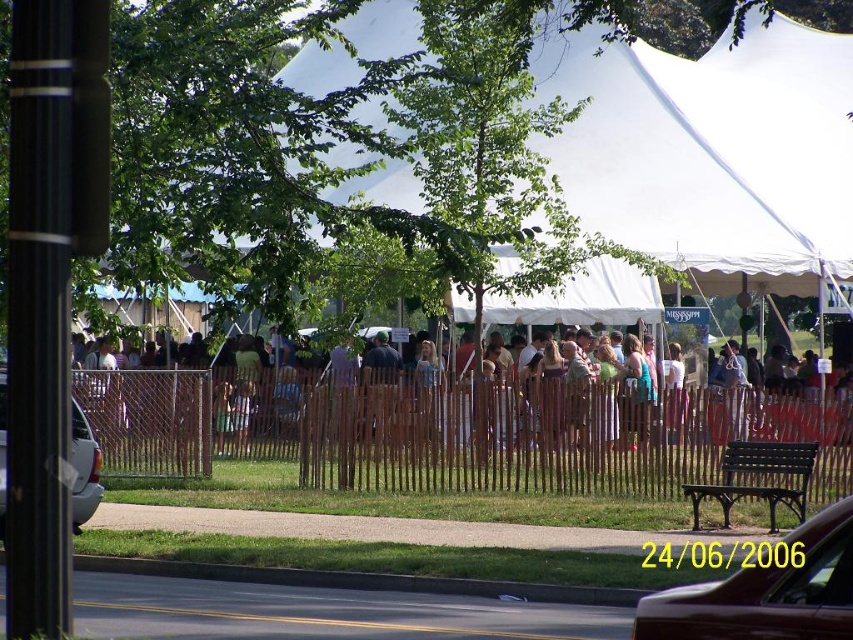
Question: Does brown wooden fence at center have a larger size compared to shiny brown car at lower right?

Choices:
 (A) no
 (B) yes

Answer: (B)

Question: Can you confirm if brown wooden fence at center is bigger than light brown wooden fence at center?

Choices:
 (A) yes
 (B) no

Answer: (B)

Question: Which point is farther from the camera taking this photo?

Choices:
 (A) (4, 500)
 (B) (337, 401)
 (C) (700, 496)

Answer: (B)

Question: Is brown wooden fence at center thinner than light brown wooden fence at center?

Choices:
 (A) yes
 (B) no

Answer: (A)

Question: Which point is closer to the camera?

Choices:
 (A) brown wooden fence at center
 (B) green wooden bench at lower right

Answer: (B)

Question: Which point is closer to the camera?

Choices:
 (A) shiny brown car at lower right
 (B) brown wooden fence at center
 (C) white matte car at left

Answer: (A)